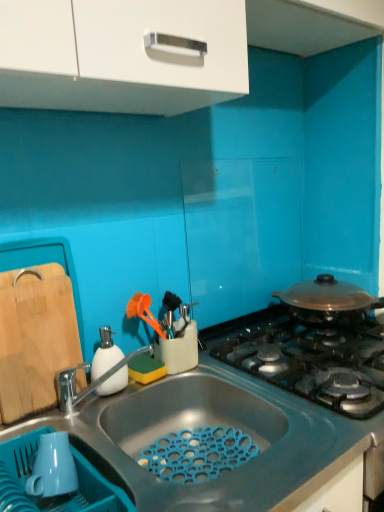
I want to click on white glossy cabinet at upper center, so click(x=121, y=55).

Find the location of `white matte soap dispenser at left`. white matte soap dispenser at left is located at coordinates (105, 354).

The height and width of the screenshot is (512, 384). What do you see at coordinates (89, 384) in the screenshot?
I see `silver metallic tap at sink left` at bounding box center [89, 384].

This screenshot has width=384, height=512. Describe the element at coordinates (35, 339) in the screenshot. I see `natural wood cutting board at left` at that location.

You are a GUI agent. You are given a task and a screenshot of the screen. Output one action in this format:
    pyautogui.click(x=<x>, y=<y>)
    Task: Click on the blue matte sink at lower center
    Image resolution: width=384 pixels, height=512 pixels.
    Given the screenshot: What is the action you would take?
    pyautogui.click(x=236, y=426)

Could you tell me if silver metallic tap at sink left is turned towards white matte soap dispenser at left?

No, silver metallic tap at sink left is not oriented towards white matte soap dispenser at left.

Is silver metallic tap at sink left wider or thinner than white matte soap dispenser at left?

Clearly, silver metallic tap at sink left has more width compared to white matte soap dispenser at left.

Who is smaller, silver metallic tap at sink left or white matte soap dispenser at left?

white matte soap dispenser at left is smaller.

Image resolution: width=384 pixels, height=512 pixels. I want to click on cutting board above the blue matte sink at lower center (from a real-world perspective), so click(x=35, y=339).

Is blue matte sink at lower center surrounding natural wood cutting board at left?

No, natural wood cutting board at left is not surrounded by blue matte sink at lower center.

Is blue matte sink at lower center wider than natural wood cutting board at left?

Yes, blue matte sink at lower center is wider than natural wood cutting board at left.

Looking at their sizes, would you say silver metallic tap at sink left is wider or thinner than white glossy cabinet at upper center?

Considering their sizes, silver metallic tap at sink left looks slimmer than white glossy cabinet at upper center.

Can you see silver metallic tap at sink left touching white glossy cabinet at upper center?

There is a gap between silver metallic tap at sink left and white glossy cabinet at upper center.

Does silver metallic tap at sink left appear on the right side of white glossy cabinet at upper center?

No, silver metallic tap at sink left is not to the right of white glossy cabinet at upper center.

What's the angular difference between white glossy cabinet at upper center and white matte soap dispenser at left's facing directions?

white glossy cabinet at upper center and white matte soap dispenser at left are facing 3.05 degrees away from each other.

Does white glossy cabinet at upper center have a lesser width compared to white matte soap dispenser at left?

No.

Is white glossy cabinet at upper center positioned beyond the bounds of white matte soap dispenser at left?

white glossy cabinet at upper center is positioned outside white matte soap dispenser at left.

Is white glossy cabinet at upper center oriented towards white matte soap dispenser at left?

No, white glossy cabinet at upper center is not oriented towards white matte soap dispenser at left.

Considering the sizes of objects white matte soap dispenser at left and white glossy cabinet at upper center in the image provided, who is smaller, white matte soap dispenser at left or white glossy cabinet at upper center?

Smaller between the two is white matte soap dispenser at left.

Consider the image. Which object is positioned more to the left, white matte soap dispenser at left or white glossy cabinet at upper center?

white matte soap dispenser at left.

Is white matte soap dispenser at left spatially inside white glossy cabinet at upper center, or outside of it?

white matte soap dispenser at left exists outside the volume of white glossy cabinet at upper center.

Consider the image. From the image's perspective, is white matte soap dispenser at left positioned above or below white glossy cabinet at upper center?

Clearly, from the image's perspective, white matte soap dispenser at left is below white glossy cabinet at upper center.

From the image's perspective, which is below, white matte soap dispenser at left or silver metallic tap at sink left?

silver metallic tap at sink left, from the image's perspective.

Can you tell me how much white matte soap dispenser at left and silver metallic tap at sink left differ in facing direction?

30.1 degrees.

Is point (108, 352) more distant than point (81, 399)?

Yes.

In the scene shown: How much distance is there between white matte soap dispenser at left and silver metallic tap at sink left?

The distance of white matte soap dispenser at left from silver metallic tap at sink left is 1.74 inches.

Does white matte soap dispenser at left turn towards natural wood cutting board at left?

No, white matte soap dispenser at left is not facing towards natural wood cutting board at left.

Consider the image. Does white matte soap dispenser at left appear on the left side of natural wood cutting board at left?

In fact, white matte soap dispenser at left is to the right of natural wood cutting board at left.

Considering the relative sizes of white matte soap dispenser at left and natural wood cutting board at left in the image provided, is white matte soap dispenser at left bigger than natural wood cutting board at left?

Actually, white matte soap dispenser at left might be smaller than natural wood cutting board at left.

This screenshot has width=384, height=512. Find the location of `appliance located behind the silver metallic tap at sink left`. appliance located behind the silver metallic tap at sink left is located at coordinates (105, 354).

You are a GUI agent. You are given a task and a screenshot of the screen. Output one action in this format:
    pyautogui.click(x=<x>, y=<y>)
    Task: Click on the countertop that appears on the right of natural wood cutting board at left
    The height and width of the screenshot is (512, 384).
    Given the screenshot: What is the action you would take?
    pyautogui.click(x=236, y=426)

When comparing their distances from blue matte sink at lower center, does white matte soap dispenser at left or natural wood cutting board at left seem further?

natural wood cutting board at left is further to blue matte sink at lower center.

Based on their spatial positions, is blue matte sink at lower center or natural wood cutting board at left further from white glossy cabinet at upper center?

Based on the image, blue matte sink at lower center appears to be further to white glossy cabinet at upper center.

When comparing their distances from natural wood cutting board at left, does silver metallic tap at sink left or blue matte sink at lower center seem closer?

Based on the image, silver metallic tap at sink left appears to be nearer to natural wood cutting board at left.

Looking at the image, which one is located further to white matte soap dispenser at left, blue matte sink at lower center or white glossy cabinet at upper center?

white glossy cabinet at upper center is positioned further to the anchor white matte soap dispenser at left.

Considering their positions, is white glossy cabinet at upper center positioned closer to natural wood cutting board at left than blue matte sink at lower center?

Among the two, blue matte sink at lower center is located nearer to natural wood cutting board at left.

Estimate the real-world distances between objects in this image. Which object is further from white matte soap dispenser at left, blue matte sink at lower center or silver metallic tap at sink left?

blue matte sink at lower center is further to white matte soap dispenser at left.

From the image, which object appears to be nearer to natural wood cutting board at left, silver metallic tap at sink left or white glossy cabinet at upper center?

→ silver metallic tap at sink left.

Estimate the real-world distances between objects in this image. Which object is further from blue matte sink at lower center, white glossy cabinet at upper center or silver metallic tap at sink left?

The object further to blue matte sink at lower center is white glossy cabinet at upper center.

Where is `cutting board between blue matte sink at lower center and white matte soap dispenser at left in the front-back direction`? Image resolution: width=384 pixels, height=512 pixels. cutting board between blue matte sink at lower center and white matte soap dispenser at left in the front-back direction is located at coordinates (35, 339).

Find the location of a particular element. Image resolution: width=384 pixels, height=512 pixels. appliance that lies between white glossy cabinet at upper center and silver metallic tap at sink left from top to bottom is located at coordinates (105, 354).

Identify the location of appliance between white glossy cabinet at upper center and blue matte sink at lower center in the up-down direction. (105, 354).

The height and width of the screenshot is (512, 384). I want to click on appliance situated between natural wood cutting board at left and silver metallic tap at sink left from left to right, so click(x=105, y=354).